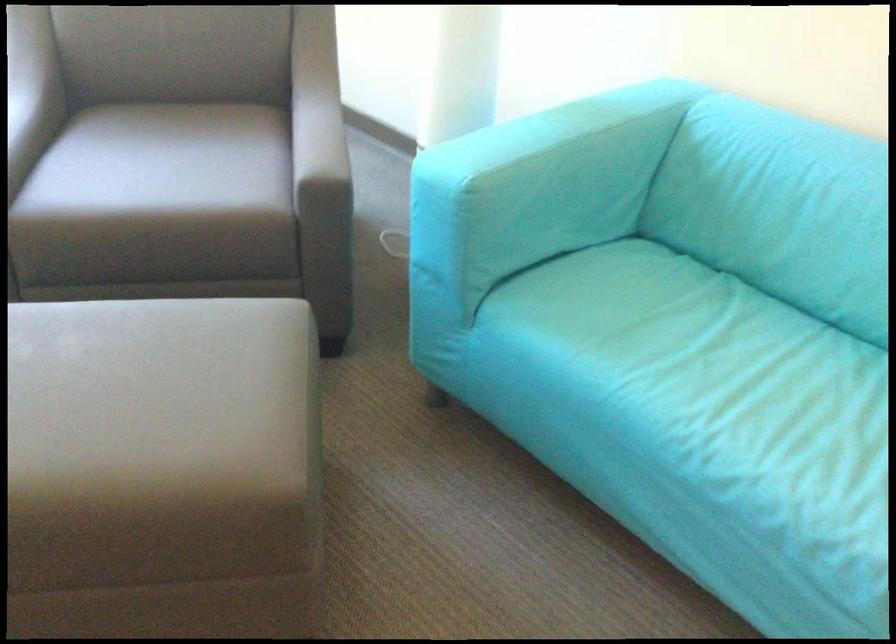
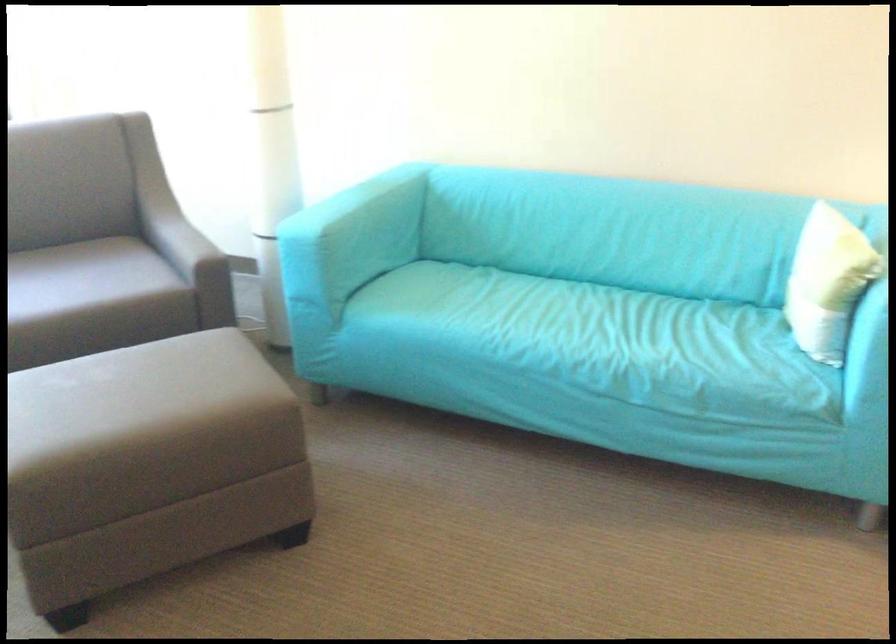
Locate, in the second image, the point that corresponds to [519,210] in the first image.

(340, 242)